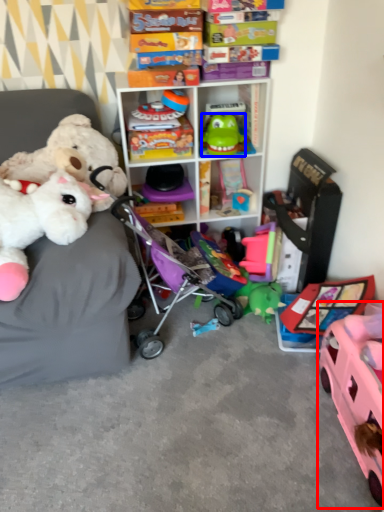
Question: Which object is closer to the camera taking this photo, toy (highlighted by a red box) or toy (highlighted by a blue box)?

Choices:
 (A) toy
 (B) toy

Answer: (A)